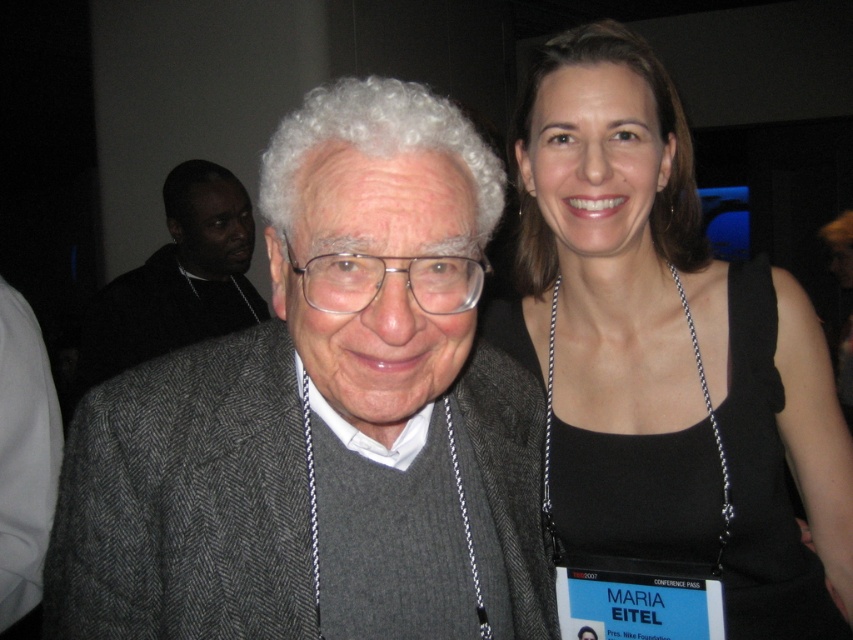
Question: Is gray herringbone blazer at center smaller than black fabric tank top at upper right?

Choices:
 (A) no
 (B) yes

Answer: (B)

Question: Is dark gray sweater at center above silver chain necklace at upper right?

Choices:
 (A) no
 (B) yes

Answer: (B)

Question: Among these objects, which one is nearest to the camera?

Choices:
 (A) dark gray sweater at center
 (B) black fabric tank top at upper right

Answer: (B)

Question: Which point is closer to the camera taking this photo?

Choices:
 (A) (180, 580)
 (B) (708, 397)

Answer: (A)

Question: In this image, where is black fabric tank top at upper right located relative to silver chain necklace at upper right?

Choices:
 (A) left
 (B) right

Answer: (B)

Question: Which object is positioned farthest from the silver chain necklace at upper right?

Choices:
 (A) black fabric tank top at upper right
 (B) gray herringbone blazer at center
 (C) dark gray sweater at center

Answer: (C)